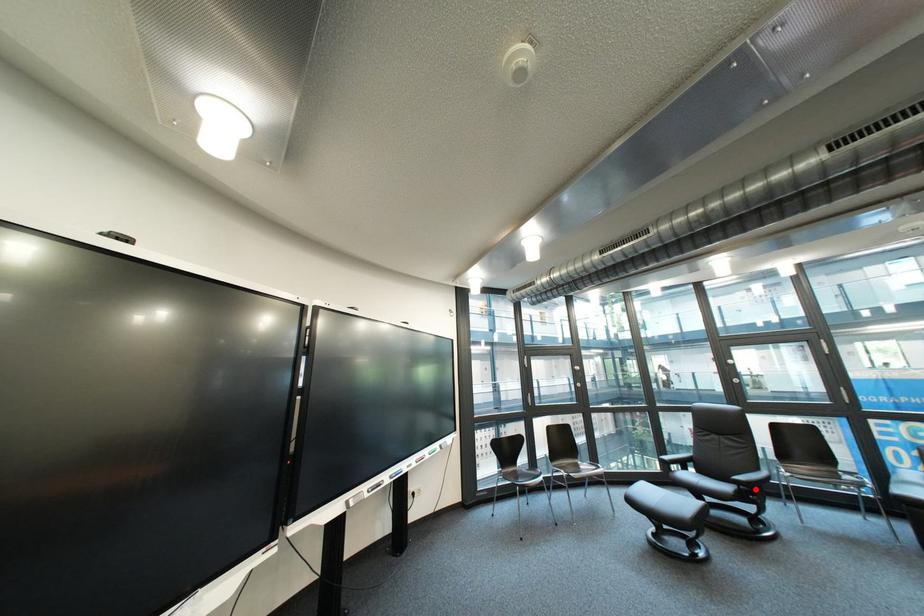
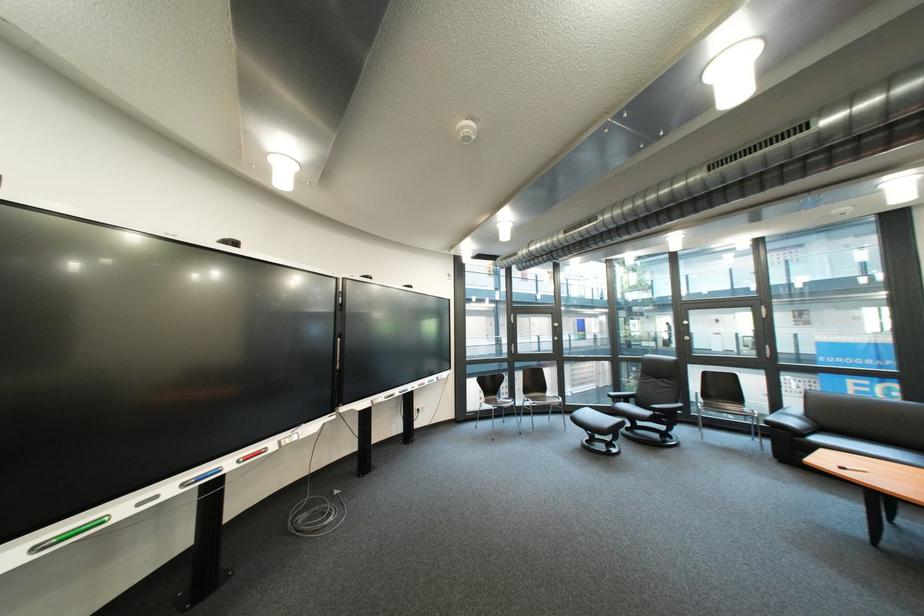
Question: I am providing you with two images of the same scene from different viewpoints. A red point is marked on the first image. Is the red point's position out of view in image 2?

Choices:
 (A) Yes
 (B) No

Answer: (B)